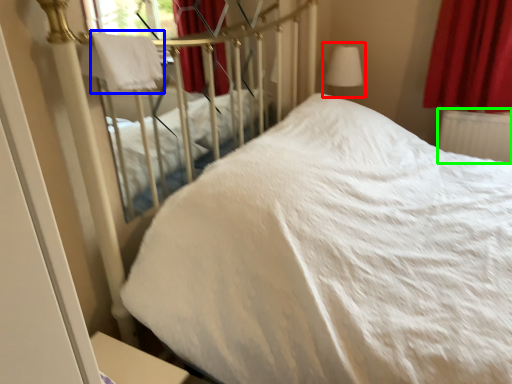
Question: Which object is the farthest from table lamp (highlighted by a red box)? Choose among these: blanket (highlighted by a blue box) or radiator (highlighted by a green box).

Choices:
 (A) blanket
 (B) radiator

Answer: (A)